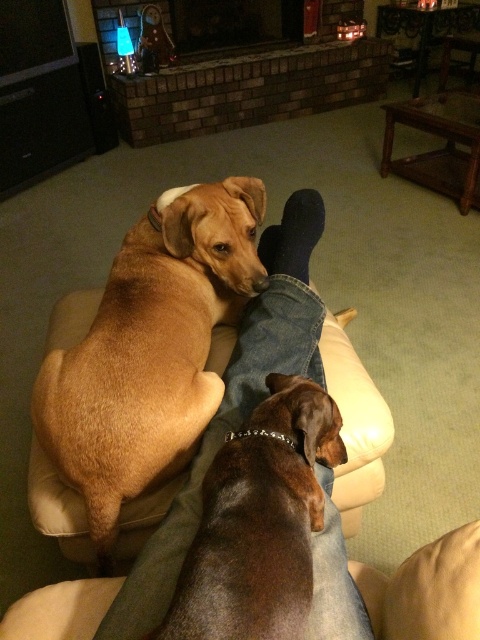
The height and width of the screenshot is (640, 480). I want to click on brown furry dog at center, so click(151, 349).

Which is behind, point (139, 364) or point (127, 100)?

The point (127, 100) is more distant.

Is point (156, 260) positioned in front of point (195, 106)?

Yes, it is.

This screenshot has height=640, width=480. I want to click on brown furry dog at center, so click(151, 349).

Does point (190, 586) come behind point (197, 104)?

That is False.

Measure the distance between point (x=320, y=529) and camera.

The distance of point (x=320, y=529) from camera is 37.48 inches.

This screenshot has height=640, width=480. In order to click on brown shiny dog at center in this screenshot , I will do `click(260, 522)`.

Is brown furry dog at center to the right of brown shiny dog at center from the viewer's perspective?

Incorrect, brown furry dog at center is not on the right side of brown shiny dog at center.

Which is behind, point (175, 362) or point (232, 548)?

The point (175, 362) is more distant.

You are a GUI agent. You are given a task and a screenshot of the screen. Output one action in this format:
    pyautogui.click(x=<x>, y=<y>)
    Task: Click on the brown furry dog at center
    
    Given the screenshot: What is the action you would take?
    pyautogui.click(x=151, y=349)